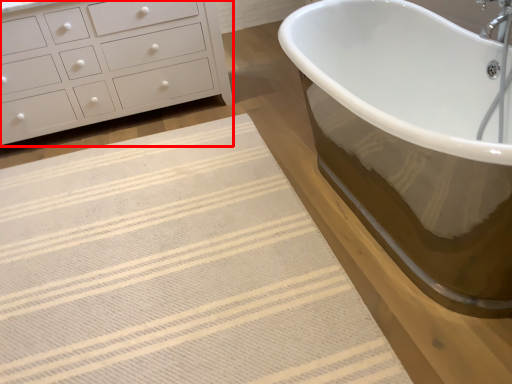
Question: From the image's perspective, where is chest of drawers (annotated by the red box) located relative to bath mat?

Choices:
 (A) above
 (B) below

Answer: (A)